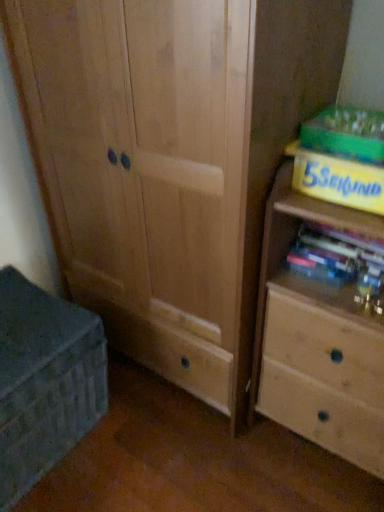
Question: Would you say yellow matte paperback book at upper right, which ranks as the 1th paperback book in bottom-to-top order, is inside or outside yellow cardboard book at upper right, which is the 2th paperback book from bottom to top?

Choices:
 (A) inside
 (B) outside

Answer: (B)

Question: Would you say yellow matte paperback book at upper right, which ranks as the 1th paperback book in bottom-to-top order, is to the left or to the right of yellow cardboard book at upper right, the first paperback book when ordered from top to bottom, in the picture?

Choices:
 (A) left
 (B) right

Answer: (B)

Question: Considering the real-world distances, which object is closest to the matte gray chest at lower left?

Choices:
 (A) light wood chest of drawers at right
 (B) yellow matte paperback book at upper right, which is the second paperback book in top-to-bottom order
 (C) yellow cardboard book at upper right, the first paperback book when ordered from top to bottom
 (D) matte plastic books at right

Answer: (A)

Question: Which is nearer to the yellow cardboard book at upper right, the first paperback book when ordered from top to bottom?

Choices:
 (A) matte gray chest at lower left
 (B) light wood chest of drawers at right
 (C) yellow matte paperback book at upper right, which ranks as the 1th paperback book in bottom-to-top order
 (D) matte plastic books at right

Answer: (C)